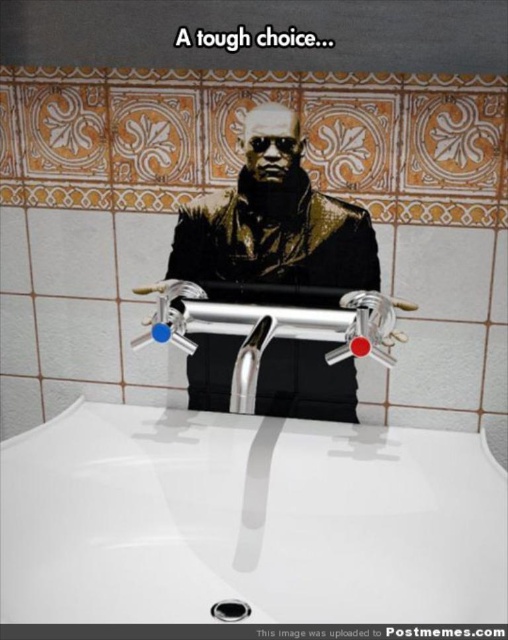
Question: Is white glossy sink at center positioned before silver metallic faucet at center?

Choices:
 (A) yes
 (B) no

Answer: (A)

Question: Is metallic gold jacket at center wider than polished chrome faucet at center?

Choices:
 (A) no
 (B) yes

Answer: (A)

Question: Which point appears closest to the camera in this image?

Choices:
 (A) (223, 620)
 (B) (430, 444)
 (C) (258, 374)

Answer: (A)

Question: Can you confirm if white glossy sink at center is wider than metallic gold jacket at center?

Choices:
 (A) no
 (B) yes

Answer: (B)

Question: Estimate the real-world distances between objects in this image. Which object is farther from the silver metallic faucet at center?

Choices:
 (A) white glossy sink at center
 (B) black rubber drain at center
 (C) metallic gold jacket at center

Answer: (B)

Question: Among these objects, which one is farthest from the camera?

Choices:
 (A) polished chrome faucet at center
 (B) black rubber drain at center

Answer: (B)